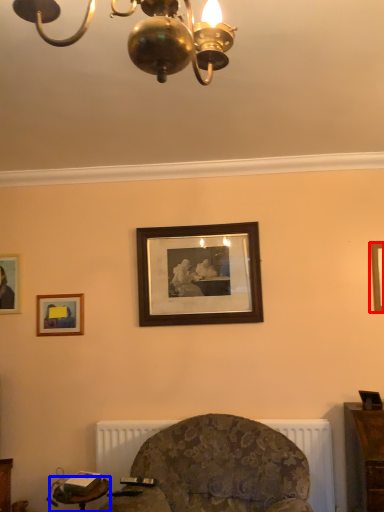
Question: Which object is further to the camera taking this photo, picture frame (highlighted by a red box) or table (highlighted by a blue box)?

Choices:
 (A) picture frame
 (B) table

Answer: (A)